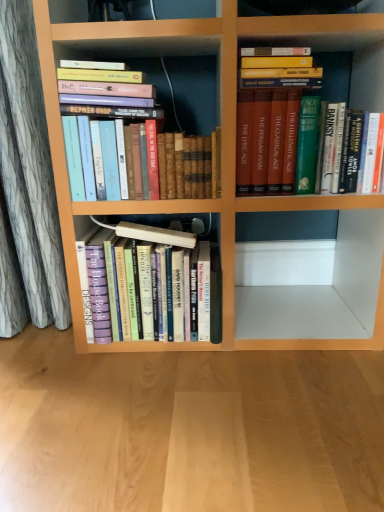
Where is `hardcover books at center, arranged as the second book when viewed from the left`? This screenshot has width=384, height=512. hardcover books at center, arranged as the second book when viewed from the left is located at coordinates (147, 282).

What do you see at coordinates (263, 140) in the screenshot? The image size is (384, 512). I see `green hardcover book at upper right, marked as the third book in a left-to-right arrangement` at bounding box center [263, 140].

You are a GUI agent. You are given a task and a screenshot of the screen. Output one action in this format:
    pyautogui.click(x=<x>, y=<y>)
    Task: Click on the green hardcover book at upper right, the first book in the right-to-left sequence
    
    Given the screenshot: What is the action you would take?
    pyautogui.click(x=263, y=140)

What do you see at coordinates (131, 144) in the screenshot?
I see `hardcover books at upper left, the 1th book when ordered from left to right` at bounding box center [131, 144].

Where is `hardcover books at center, arranged as the second book when viewed from the left`? hardcover books at center, arranged as the second book when viewed from the left is located at coordinates (147, 282).

Between green hardcover book at upper right, marked as the third book in a left-to-right arrangement, and wooden floor at lower center, which one appears on the right side from the viewer's perspective?

From the viewer's perspective, green hardcover book at upper right, marked as the third book in a left-to-right arrangement, appears more on the right side.

Does green hardcover book at upper right, marked as the third book in a left-to-right arrangement, come in front of wooden floor at lower center?

No, the depth of green hardcover book at upper right, marked as the third book in a left-to-right arrangement, is greater than that of wooden floor at lower center.

Which of these two, green hardcover book at upper right, marked as the third book in a left-to-right arrangement, or wooden floor at lower center, stands shorter?

Standing shorter between the two is wooden floor at lower center.

From a real-world perspective, starting from the wooden floor at lower center, which book is the 3rd one vertically above it? Please provide its 2D coordinates.

[(263, 140)]

Looking at this image, can you confirm if wooden floor at lower center is positioned to the left of hardcover books at center, which ranks as the 2th book in right-to-left order?

No, wooden floor at lower center is not to the left of hardcover books at center, which ranks as the 2th book in right-to-left order.

Is the position of wooden floor at lower center more distant than that of hardcover books at center, arranged as the second book when viewed from the left?

That is False.

From a real-world perspective, is wooden floor at lower center positioned above or below hardcover books at center, arranged as the second book when viewed from the left?

wooden floor at lower center is situated lower than hardcover books at center, arranged as the second book when viewed from the left, in the real world.

Is wooden floor at lower center positioned with its back to hardcover books at upper left, placed as the third book when sorted from right to left?

No, wooden floor at lower center is not facing the opposite direction of hardcover books at upper left, placed as the third book when sorted from right to left.

Between wooden floor at lower center and hardcover books at upper left, the 1th book when ordered from left to right, which one has smaller width?

hardcover books at upper left, the 1th book when ordered from left to right, is thinner.

From a real-world perspective, is wooden floor at lower center below hardcover books at upper left, placed as the third book when sorted from right to left?

Correct, in the physical world, wooden floor at lower center is lower than hardcover books at upper left, placed as the third book when sorted from right to left.

Does point (317, 81) come farther from viewer compared to point (134, 167)?

That is False.

What's the angular difference between green hardcover book at upper right, the first book in the right-to-left sequence, and hardcover books at upper left, the 1th book when ordered from left to right,'s facing directions?

There is a 3.2-degree angle between the facing directions of green hardcover book at upper right, the first book in the right-to-left sequence, and hardcover books at upper left, the 1th book when ordered from left to right.

From the image's perspective, is green hardcover book at upper right, marked as the third book in a left-to-right arrangement, beneath hardcover books at upper left, placed as the third book when sorted from right to left?

No, from the image's perspective, green hardcover book at upper right, marked as the third book in a left-to-right arrangement, is not below hardcover books at upper left, placed as the third book when sorted from right to left.

Considering the relative sizes of green hardcover book at upper right, the first book in the right-to-left sequence, and hardcover books at upper left, the 1th book when ordered from left to right, in the image provided, is green hardcover book at upper right, the first book in the right-to-left sequence, shorter than hardcover books at upper left, the 1th book when ordered from left to right,?

No.

Is point (155, 134) positioned in front of point (52, 377)?

That is True.

Is wooden floor at lower center surrounded by hardcover books at upper left, placed as the third book when sorted from right to left?

No, wooden floor at lower center is not inside hardcover books at upper left, placed as the third book when sorted from right to left.

Based on their positions, is hardcover books at upper left, placed as the third book when sorted from right to left, located to the left or right of wooden floor at lower center?

Based on their positions, hardcover books at upper left, placed as the third book when sorted from right to left, is located to the left of wooden floor at lower center.

Could you tell me if hardcover books at upper left, the 1th book when ordered from left to right, is facing wooden floor at lower center?

No, hardcover books at upper left, the 1th book when ordered from left to right, is not turned towards wooden floor at lower center.

This screenshot has width=384, height=512. What are the coordinates of `the 1st book in front of the hardcover books at center, which ranks as the 2th book in right-to-left order` in the screenshot? It's located at (263, 140).

Which object is further away from the camera taking this photo, hardcover books at center, arranged as the second book when viewed from the left, or green hardcover book at upper right, the first book in the right-to-left sequence?

hardcover books at center, arranged as the second book when viewed from the left, is further from the camera.

Consider the image. Does hardcover books at center, arranged as the second book when viewed from the left, contain green hardcover book at upper right, marked as the third book in a left-to-right arrangement?

No, hardcover books at center, arranged as the second book when viewed from the left, does not contain green hardcover book at upper right, marked as the third book in a left-to-right arrangement.

Visually, is green hardcover book at upper right, the first book in the right-to-left sequence, positioned to the left or to the right of hardcover books at center, which ranks as the 2th book in right-to-left order?

green hardcover book at upper right, the first book in the right-to-left sequence, is positioned on hardcover books at center, which ranks as the 2th book in right-to-left order,'s right side.

Considering the relative sizes of green hardcover book at upper right, the first book in the right-to-left sequence, and hardcover books at center, arranged as the second book when viewed from the left, in the image provided, is green hardcover book at upper right, the first book in the right-to-left sequence, shorter than hardcover books at center, arranged as the second book when viewed from the left,?

Yes.

From a real-world perspective, is green hardcover book at upper right, the first book in the right-to-left sequence, positioned above or below hardcover books at center, which ranks as the 2th book in right-to-left order?

green hardcover book at upper right, the first book in the right-to-left sequence, is above hardcover books at center, which ranks as the 2th book in right-to-left order.

From the wooden floor at lower center, count 2nd books backward and point to it. Please provide its 2D coordinates.

[(263, 140)]

Image resolution: width=384 pixels, height=512 pixels. Identify the location of plain on the right of hardcover books at center, arranged as the second book when viewed from the left. (188, 429).

From the image, which object appears to be nearer to hardcover books at upper left, placed as the third book when sorted from right to left, wooden floor at lower center or green hardcover book at upper right, the first book in the right-to-left sequence?

green hardcover book at upper right, the first book in the right-to-left sequence.

From the image, which object appears to be farther from hardcover books at upper left, placed as the third book when sorted from right to left, hardcover books at center, arranged as the second book when viewed from the left, or wooden floor at lower center?

wooden floor at lower center lies further to hardcover books at upper left, placed as the third book when sorted from right to left, than the other object.

When comparing their distances from hardcover books at upper left, placed as the third book when sorted from right to left, does green hardcover book at upper right, marked as the third book in a left-to-right arrangement, or wooden floor at lower center seem closer?

Based on the image, green hardcover book at upper right, marked as the third book in a left-to-right arrangement, appears to be nearer to hardcover books at upper left, placed as the third book when sorted from right to left.

Considering their positions, is hardcover books at upper left, the 1th book when ordered from left to right, positioned further to hardcover books at center, arranged as the second book when viewed from the left, than green hardcover book at upper right, the first book in the right-to-left sequence?

Among the two, green hardcover book at upper right, the first book in the right-to-left sequence, is located further to hardcover books at center, arranged as the second book when viewed from the left.

From the image, which object appears to be farther from green hardcover book at upper right, marked as the third book in a left-to-right arrangement, wooden floor at lower center or hardcover books at center, arranged as the second book when viewed from the left?

Among the two, wooden floor at lower center is located further to green hardcover book at upper right, marked as the third book in a left-to-right arrangement.

When comparing their distances from wooden floor at lower center, does hardcover books at upper left, the 1th book when ordered from left to right, or green hardcover book at upper right, the first book in the right-to-left sequence, seem further?

The object further to wooden floor at lower center is green hardcover book at upper right, the first book in the right-to-left sequence.

From the image, which object appears to be farther from wooden floor at lower center, green hardcover book at upper right, the first book in the right-to-left sequence, or hardcover books at upper left, placed as the third book when sorted from right to left?

green hardcover book at upper right, the first book in the right-to-left sequence, lies further to wooden floor at lower center than the other object.

Looking at the image, which one is located closer to hardcover books at upper left, the 1th book when ordered from left to right, wooden floor at lower center or hardcover books at center, arranged as the second book when viewed from the left?

Based on the image, hardcover books at center, arranged as the second book when viewed from the left, appears to be nearer to hardcover books at upper left, the 1th book when ordered from left to right.

Where is `book between hardcover books at upper left, the 1th book when ordered from left to right, and green hardcover book at upper right, marked as the third book in a left-to-right arrangement, from left to right`? book between hardcover books at upper left, the 1th book when ordered from left to right, and green hardcover book at upper right, marked as the third book in a left-to-right arrangement, from left to right is located at coordinates (147, 282).

Locate an element on the screen. The width and height of the screenshot is (384, 512). book between hardcover books at upper left, placed as the third book when sorted from right to left, and wooden floor at lower center, in the vertical direction is located at coordinates (147, 282).